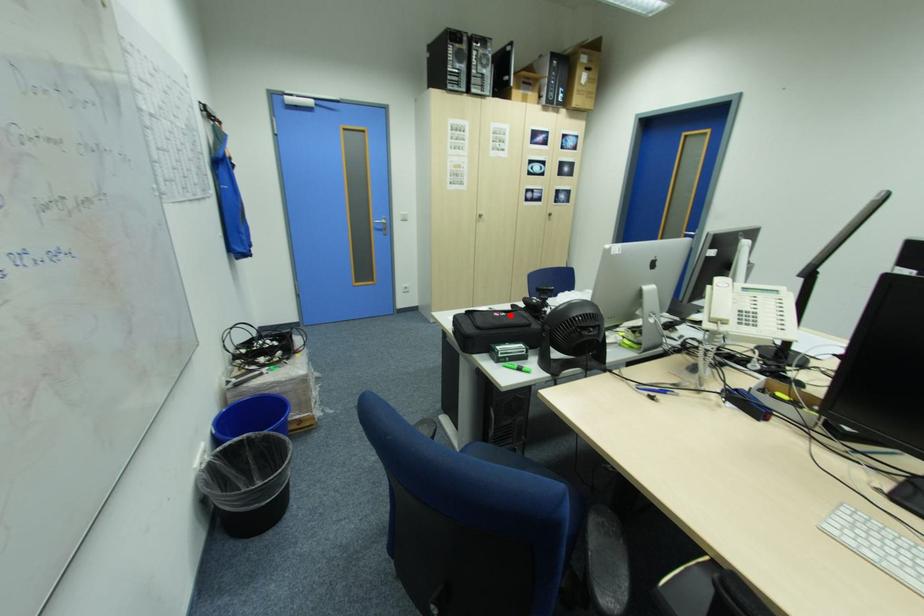
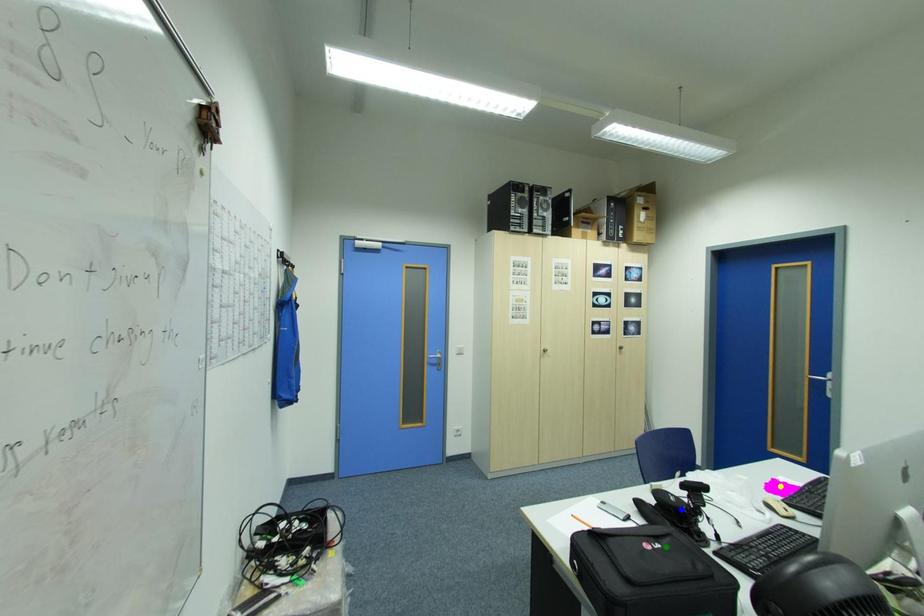
Question: I am providing you with two images of the same scene from different viewpoints. A red point is marked on the first image. You are given multiple points on the second image. In image 2, which mark is for the same physical point as the one in image 1?

Choices:
 (A) yellow point
 (B) blue point
 (C) green point

Answer: (C)